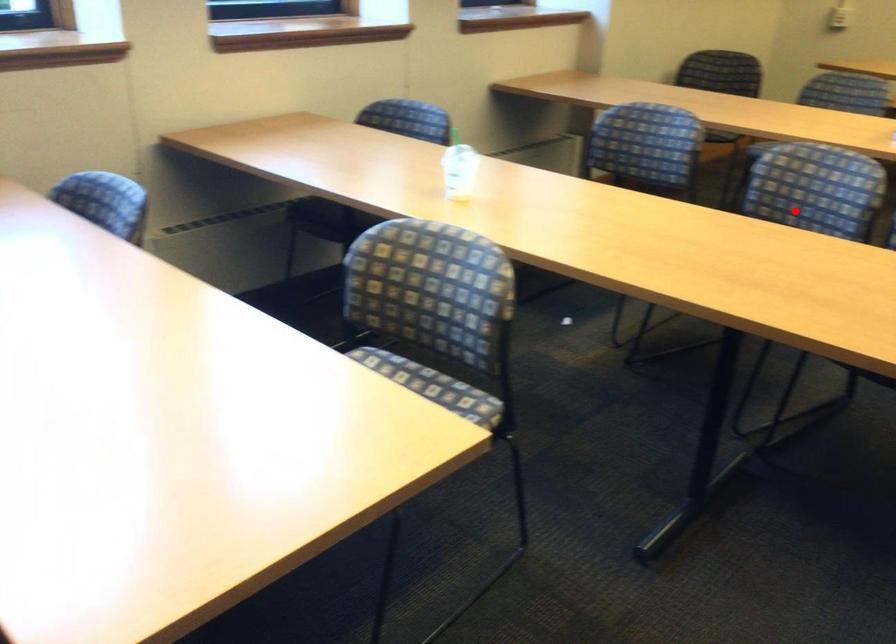
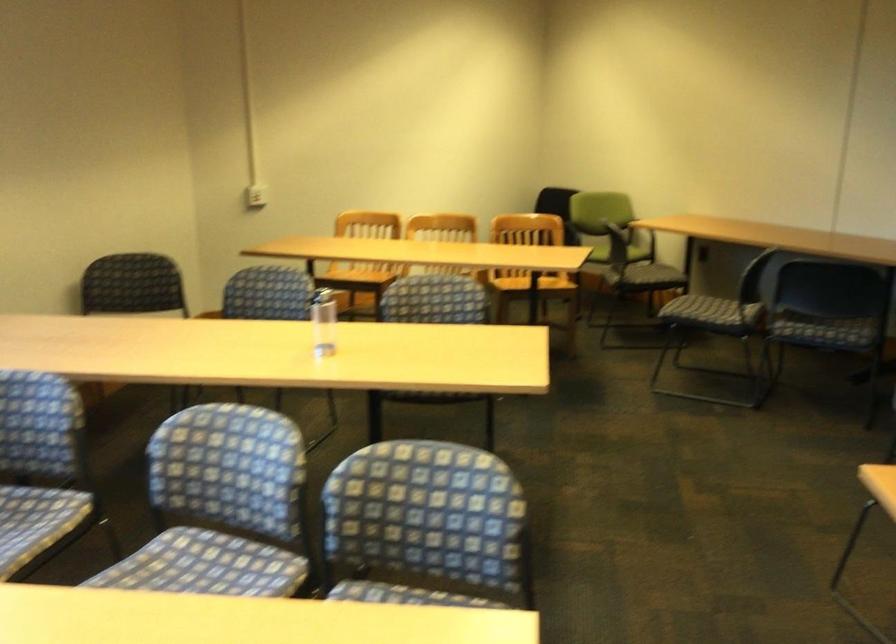
Find the pixel in the second image that matches the highlighted location in the first image.

(221, 506)